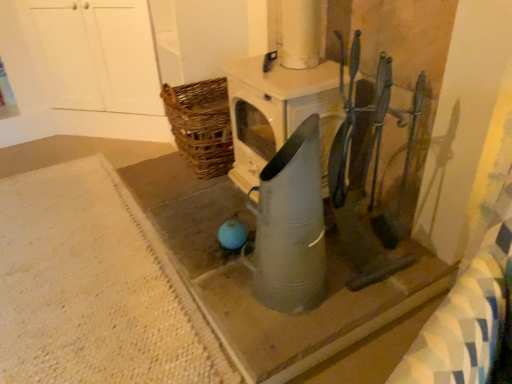
Question: Can you confirm if metallic gray watering can at center, which is counted as the 2th concrete, starting from the left, is wider than metallic gray watering can at center?

Choices:
 (A) yes
 (B) no

Answer: (A)

Question: Considering the relative sizes of metallic gray watering can at center, which is counted as the 2th concrete, starting from the left, and metallic gray watering can at center in the image provided, is metallic gray watering can at center, which is counted as the 2th concrete, starting from the left, bigger than metallic gray watering can at center?

Choices:
 (A) no
 (B) yes

Answer: (B)

Question: Considering the relative positions of metallic gray watering can at center, the 1th concrete viewed from the right, and metallic gray watering can at center in the image provided, is metallic gray watering can at center, the 1th concrete viewed from the right, to the left of metallic gray watering can at center from the viewer's perspective?

Choices:
 (A) no
 (B) yes

Answer: (B)

Question: Does metallic gray watering can at center, which is counted as the 2th concrete, starting from the left, appear on the right side of metallic gray watering can at center?

Choices:
 (A) no
 (B) yes

Answer: (A)

Question: Considering the relative sizes of metallic gray watering can at center, the 1th concrete viewed from the right, and metallic gray watering can at center in the image provided, is metallic gray watering can at center, the 1th concrete viewed from the right, thinner than metallic gray watering can at center?

Choices:
 (A) yes
 (B) no

Answer: (B)

Question: Considering the relative sizes of metallic gray watering can at center, the 1th concrete viewed from the right, and metallic gray watering can at center in the image provided, is metallic gray watering can at center, the 1th concrete viewed from the right, shorter than metallic gray watering can at center?

Choices:
 (A) yes
 (B) no

Answer: (A)

Question: Does metallic gray watering can at center lie in front of white textured rug at lower left, which is counted as the first concrete, starting from the left?

Choices:
 (A) no
 (B) yes

Answer: (B)

Question: Is metallic gray watering can at center not close to white textured rug at lower left, which is counted as the first concrete, starting from the left?

Choices:
 (A) no
 (B) yes

Answer: (A)

Question: Is metallic gray watering can at center taller than white textured rug at lower left, which is counted as the first concrete, starting from the left?

Choices:
 (A) no
 (B) yes

Answer: (B)

Question: Can we say metallic gray watering can at center lies outside white textured rug at lower left, which is counted as the first concrete, starting from the left?

Choices:
 (A) yes
 (B) no

Answer: (A)

Question: Is metallic gray watering can at center at the right side of white textured rug at lower left, arranged as the second concrete when viewed from the right?

Choices:
 (A) no
 (B) yes

Answer: (B)

Question: Is white textured rug at lower left, arranged as the second concrete when viewed from the right, at the back of metallic gray watering can at center?

Choices:
 (A) yes
 (B) no

Answer: (B)

Question: From the image's perspective, is metallic gray watering can at center located beneath metallic gray watering can at center, which is counted as the 2th concrete, starting from the left?

Choices:
 (A) yes
 (B) no

Answer: (B)